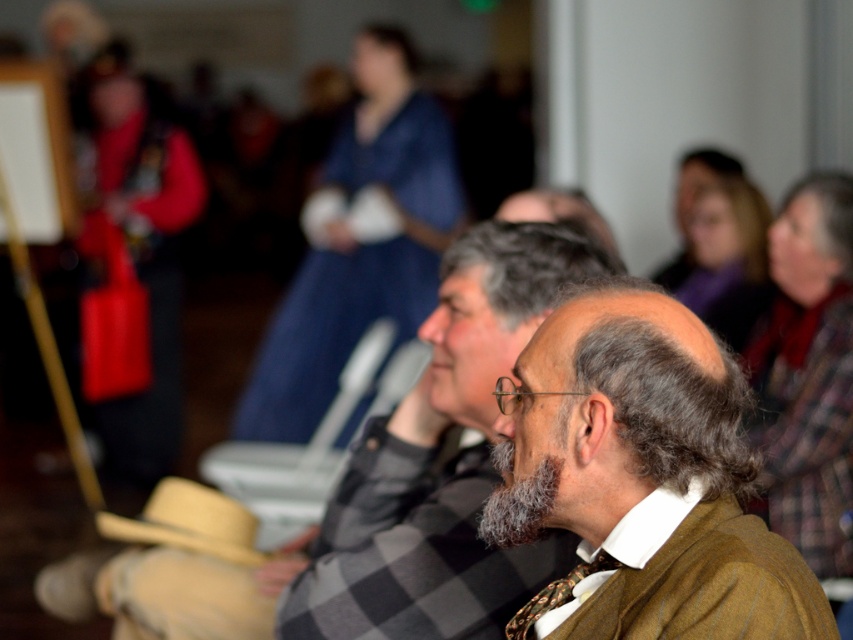
You are organizing a clothing donation drive and need to determine if the brown woolen sweater at center can fit into a donation box that is the same width as the printed silk tie at center. Based on the image, can the sweater fit?

The brown woolen sweater at center might be wider than the printed silk tie at center, so it may not fit into the donation box designed for the tie.

In the scene described, where is the brown woolen coat at center positioned relative to the gray fuzzy beard at center?

The brown woolen coat at center is to the right of the gray fuzzy beard at center.